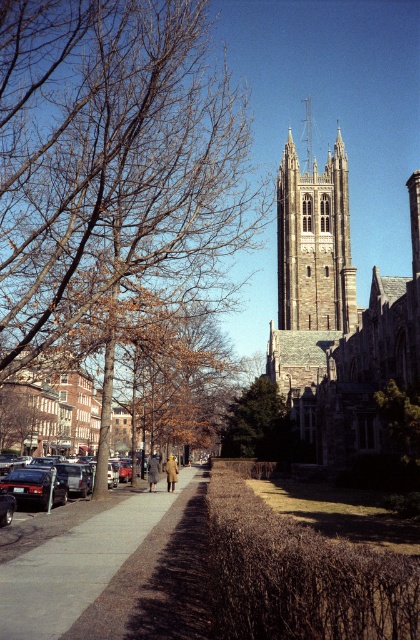
You are a city planner assessing the urban space. You need to determine if the green leafy tree at center can be transplanted to the location currently occupied by the shiny black sedan at lower left. Based on their widths, is this feasible?

The green leafy tree at center is wider than the shiny black sedan at lower left, so transplanting it to the sedan location may not be feasible due to space constraints.

You are a pedestrian standing on the sidewalk near the shiny black sedan at lower left. You want to walk towards the grand Gothic church tower in the background. Which direction should you turn to first reach the green leafy tree at center before proceeding to the church tower?

You should turn to your right because the green leafy tree at center is located to the right of the shiny black sedan at lower left, so turning right will lead you towards it before heading toward the church tower.